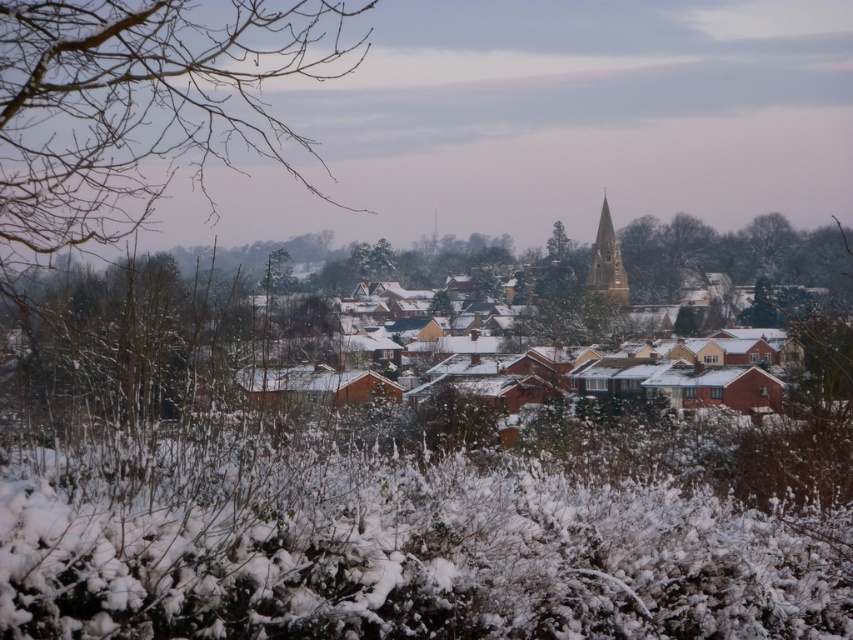
You are standing in a winter scene and see the bare branches at left and the golden stone spire at center. Which object is closer to you?

The bare branches at left are closer to you because they are in front of the golden stone spire at center.

You are an artist sketching the winter scene. You want to ensure the proportions between the bare branches at left and the golden stone spire at center are accurate. Which object should you draw wider?

The bare branches at left should be drawn wider since their width is larger than the golden stone spire at center.

You are standing in the winter scene and want to take a photo of both the bare branches at left and the green leafy tree at center. Which one should you focus on first to ensure both are in clear view?

You should focus on the bare branches at left first since it is closer to you than the green leafy tree at center, ensuring both are in focus when using depth of field.